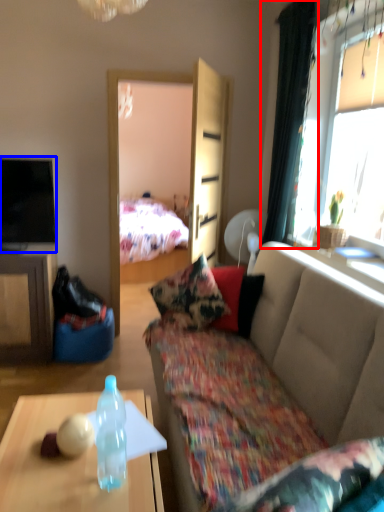
Question: Which point is further to the camera, curtain (highlighted by a red box) or television (highlighted by a blue box)?

Choices:
 (A) curtain
 (B) television

Answer: (B)